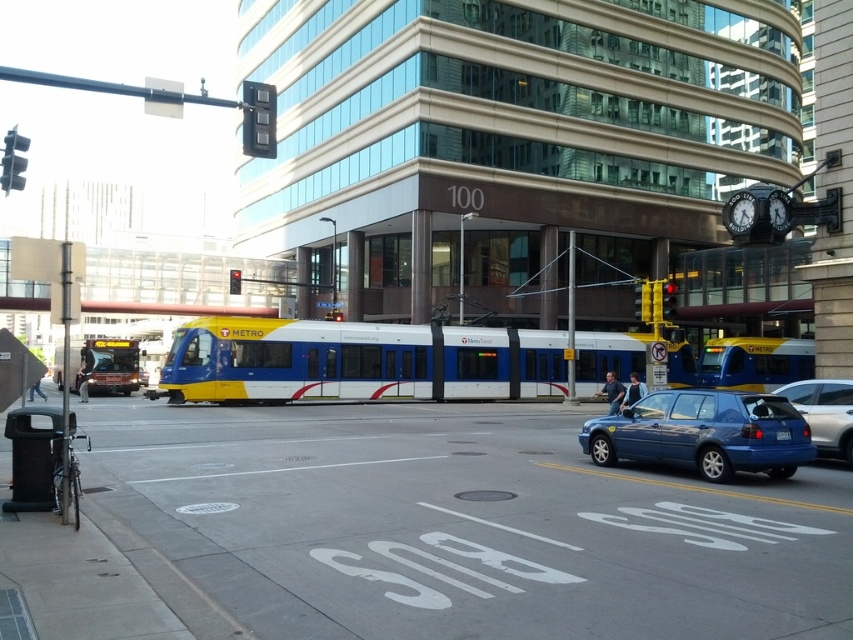
Is metallic blue sedan at lower right below yellow plastic traffic light at center?

Indeed, metallic blue sedan at lower right is positioned under yellow plastic traffic light at center.

Can you confirm if metallic blue sedan at lower right is smaller than yellow plastic traffic light at center?

Indeed, metallic blue sedan at lower right has a smaller size compared to yellow plastic traffic light at center.

Is point (846, 392) behind point (341, 316)?

No, (846, 392) is in front of (341, 316).

The height and width of the screenshot is (640, 853). I want to click on metallic blue sedan at lower right, so click(824, 413).

Between metallic blue sedan at lower right and yellow plastic traffic light at upper center, which one is positioned lower?

metallic blue sedan at lower right

Does metallic blue sedan at lower right appear on the right side of yellow plastic traffic light at upper center?

Yes, metallic blue sedan at lower right is to the right of yellow plastic traffic light at upper center.

Between point (807, 397) and point (241, 291), which one is positioned behind?

Positioned behind is point (241, 291).

The height and width of the screenshot is (640, 853). What are the coordinates of `metallic blue sedan at lower right` in the screenshot? It's located at (824, 413).

Consider the image. Is metallic blue hatchback at lower right thinner than yellow metallic traffic light at upper center?

Incorrect, metallic blue hatchback at lower right's width is not less than yellow metallic traffic light at upper center's.

Is metallic blue hatchback at lower right shorter than yellow metallic traffic light at upper center?

Incorrect, metallic blue hatchback at lower right's height does not fall short of yellow metallic traffic light at upper center's.

This screenshot has width=853, height=640. What do you see at coordinates (704, 433) in the screenshot?
I see `metallic blue hatchback at lower right` at bounding box center [704, 433].

This screenshot has height=640, width=853. What are the coordinates of `metallic blue hatchback at lower right` in the screenshot? It's located at point(704,433).